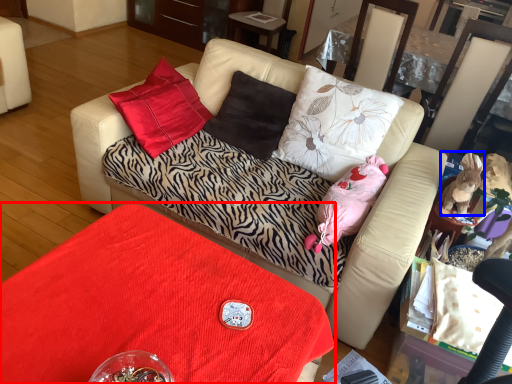
Question: Which point is further to the camera, table (highlighted by a red box) or animal (highlighted by a blue box)?

Choices:
 (A) table
 (B) animal

Answer: (B)